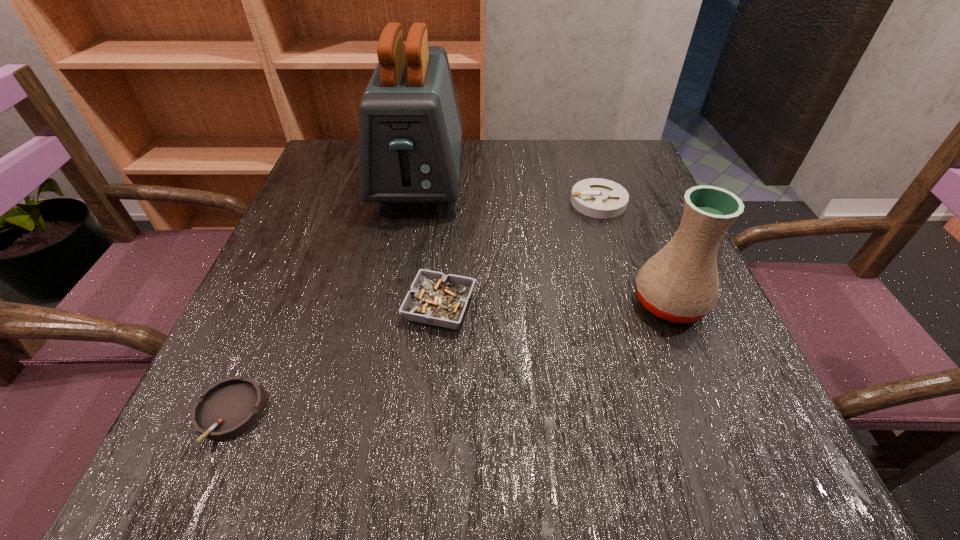
Where is `object that is at the far right corner`? object that is at the far right corner is located at coordinates (599, 198).

The image size is (960, 540). Find the location of `vacant region at the far edge of the desktop`. vacant region at the far edge of the desktop is located at coordinates (516, 186).

Locate an element on the screen. The width and height of the screenshot is (960, 540). free region at the near edge is located at coordinates (421, 424).

Locate an element on the screen. Image resolution: width=960 pixels, height=540 pixels. vacant space at the left edge of the desktop is located at coordinates (343, 247).

Identify the location of vacant space at the right edge of the desktop. (601, 256).

Where is `vacant space at the far left corner of the desktop`? This screenshot has width=960, height=540. vacant space at the far left corner of the desktop is located at coordinates (346, 171).

In the image, there is a desktop. In order to click on vacant space at the near left corner in this screenshot , I will do `click(263, 434)`.

Locate an element on the screen. free location at the far right corner of the desktop is located at coordinates (629, 194).

The height and width of the screenshot is (540, 960). I want to click on free space between the second ashtray from right to left and the rightmost ashtray, so click(519, 254).

The image size is (960, 540). Identify the location of free space between the pottery and the nearest object. (449, 359).